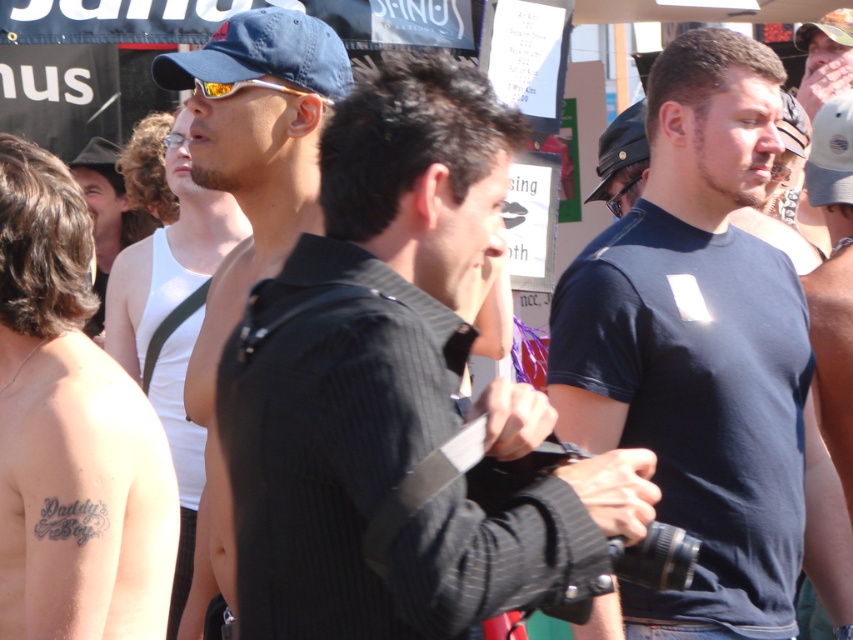
You are a photographer at the event and want to capture both the shiny skin tattoo at center and the white cotton tank top at left in a single frame. Based on their positions, can you position yourself so that both are visible without moving either object?

The shiny skin tattoo at center is to the right of the white cotton tank top at left, so positioning yourself to the left of both objects would allow you to capture both in the frame without moving them.

What are the coordinates of the shiny skin tattoo at center?

The shiny skin tattoo at center is located at point (70,433).